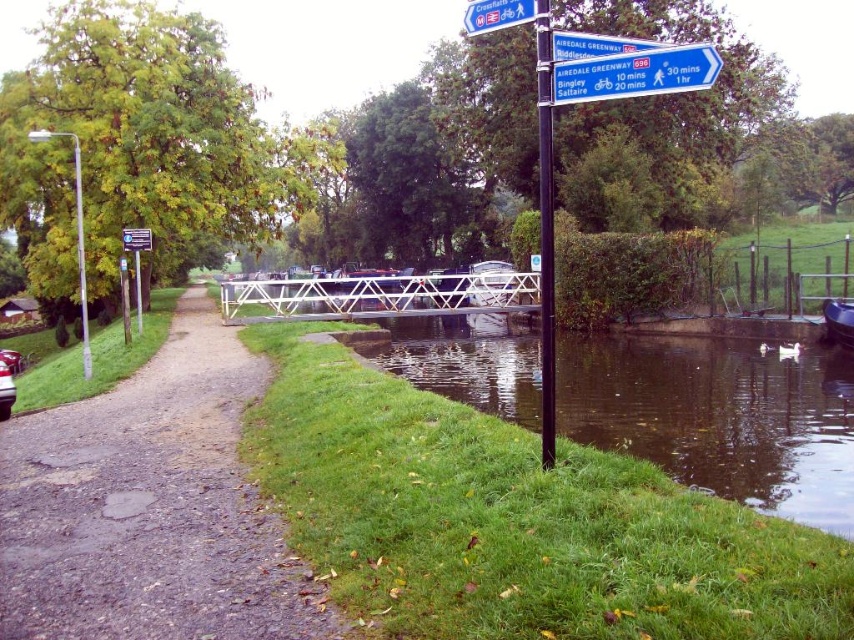
Question: Can you confirm if black metal signpost at center is smaller than blue plastic signpost at upper center?

Choices:
 (A) yes
 (B) no

Answer: (B)

Question: Based on their relative distances, which object is nearer to the blue plastic signpost at upper center?

Choices:
 (A) blue plastic signpost at upper right
 (B) dirt/gravel path at left

Answer: (A)

Question: Which point is closer to the camera taking this photo?

Choices:
 (A) (243, 381)
 (B) (624, 376)
 (C) (851, 324)

Answer: (A)

Question: Does blue plastic signpost at upper center have a smaller size compared to blue plastic boat at lower right?

Choices:
 (A) no
 (B) yes

Answer: (B)

Question: Which object appears closest to the camera in this image?

Choices:
 (A) dirt/gravel path at left
 (B) white plastic sign at upper center

Answer: (A)

Question: Can you confirm if green smooth water at lower right is positioned to the left of blue plastic signpost at upper center?

Choices:
 (A) no
 (B) yes

Answer: (A)